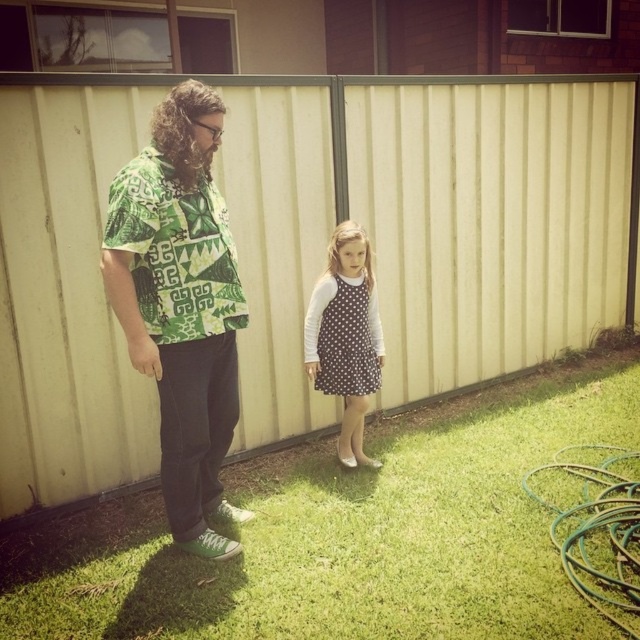
Question: Which object is the farthest from the green printed shirt at center?

Choices:
 (A) green rubber hose at lower right
 (B) beige corrugated metal fence at center

Answer: (A)

Question: Among these objects, which one is farthest from the camera?

Choices:
 (A) beige corrugated metal fence at center
 (B) polka dot fabric dress at center

Answer: (B)

Question: From the image, what is the correct spatial relationship of green grass at lower center in relation to polka dot fabric dress at center?

Choices:
 (A) below
 (B) above

Answer: (A)

Question: Does beige corrugated metal fence at center lie behind green rubber hose at lower right?

Choices:
 (A) no
 (B) yes

Answer: (B)

Question: Is beige corrugated metal fence at center to the left of green grass at lower center from the viewer's perspective?

Choices:
 (A) no
 (B) yes

Answer: (A)

Question: Estimate the real-world distances between objects in this image. Which object is closer to the green rubber hose at lower right?

Choices:
 (A) polka dot fabric dress at center
 (B) beige corrugated metal fence at center

Answer: (A)